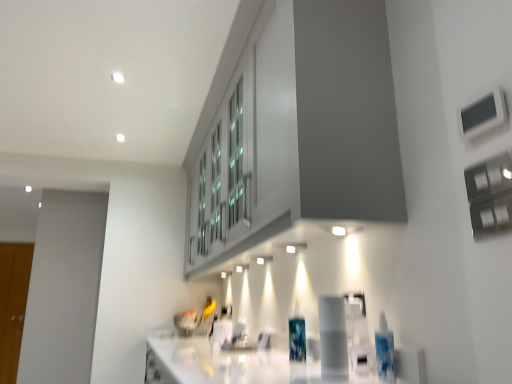
Question: Is white glossy countertop at lower center oriented away from translucent plastic bottle at center?

Choices:
 (A) yes
 (B) no

Answer: (B)

Question: Is white glossy countertop at lower center in front of translucent plastic bottle at center?

Choices:
 (A) no
 (B) yes

Answer: (B)

Question: Is white glossy countertop at lower center outside translucent plastic bottle at center?

Choices:
 (A) no
 (B) yes

Answer: (B)

Question: Is white glossy countertop at lower center touching translucent plastic bottle at center?

Choices:
 (A) yes
 (B) no

Answer: (B)

Question: From a real-world perspective, is white glossy countertop at lower center positioned over translucent plastic bottle at center based on gravity?

Choices:
 (A) yes
 (B) no

Answer: (B)

Question: Can you confirm if white glossy countertop at lower center is wider than translucent plastic bottle at center?

Choices:
 (A) no
 (B) yes

Answer: (B)

Question: Considering the relative positions of translucent plastic bottle at center and wooden glass door at left in the image provided, is translucent plastic bottle at center to the left of wooden glass door at left from the viewer's perspective?

Choices:
 (A) yes
 (B) no

Answer: (B)

Question: Can you see translucent plastic bottle at center touching wooden glass door at left?

Choices:
 (A) no
 (B) yes

Answer: (A)

Question: Is translucent plastic bottle at center not close to wooden glass door at left?

Choices:
 (A) no
 (B) yes

Answer: (B)

Question: From the image's perspective, is translucent plastic bottle at center below wooden glass door at left?

Choices:
 (A) no
 (B) yes

Answer: (A)

Question: Considering the relative sizes of translucent plastic bottle at center and wooden glass door at left in the image provided, is translucent plastic bottle at center thinner than wooden glass door at left?

Choices:
 (A) yes
 (B) no

Answer: (B)

Question: Does translucent plastic bottle at center have a lesser height compared to wooden glass door at left?

Choices:
 (A) yes
 (B) no

Answer: (A)

Question: Considering the relative sizes of white glossy countertop at lower center and wooden glass door at left in the image provided, is white glossy countertop at lower center thinner than wooden glass door at left?

Choices:
 (A) yes
 (B) no

Answer: (B)